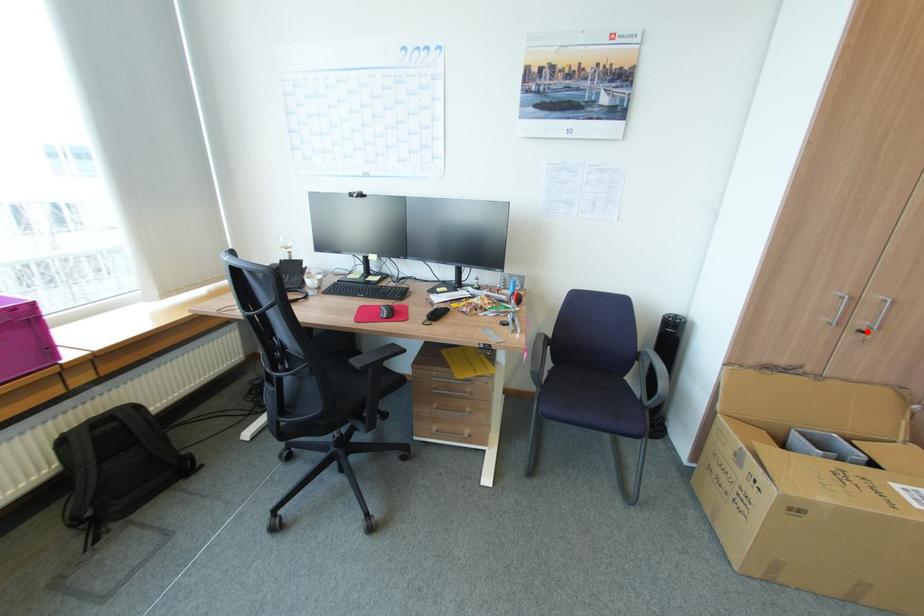
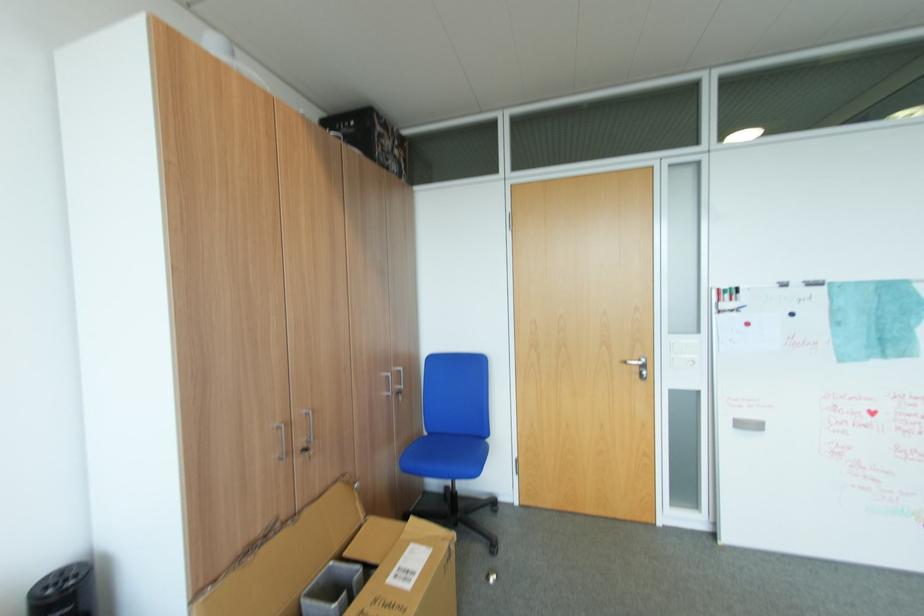
Question: I am providing you with two images of the same scene from different viewpoints. A red point is marked on the first image. Is the red point's position out of view in image 2?

Choices:
 (A) Yes
 (B) No

Answer: (B)